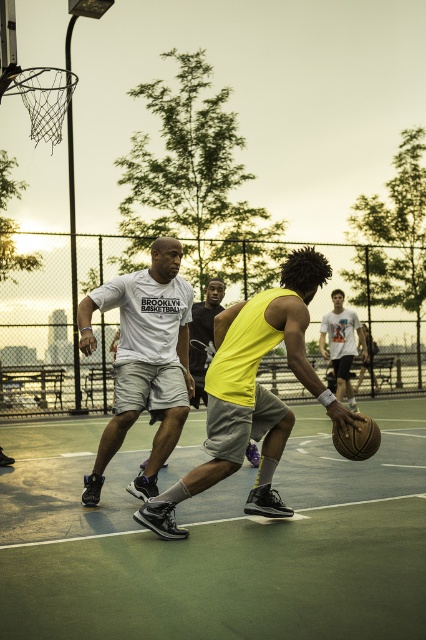
Is green rubber basketball court at center taller than white t-shirt at center?

Incorrect, green rubber basketball court at center's height is not larger of white t-shirt at center's.

Does green rubber basketball court at center appear under white t-shirt at center?

Correct, green rubber basketball court at center is located below white t-shirt at center.

Does point (389, 586) lie in front of point (348, 404)?

Yes, point (389, 586) is closer to viewer.

Identify the location of green rubber basketball court at center. (218, 541).

Does shiny yellow basketball at center have a greater height compared to white matte t-shirt at center?

No, shiny yellow basketball at center is not taller than white matte t-shirt at center.

Is shiny yellow basketball at center to the right of white matte t-shirt at center from the viewer's perspective?

Correct, you'll find shiny yellow basketball at center to the right of white matte t-shirt at center.

Which is in front, point (265, 349) or point (144, 298)?

Point (265, 349) is in front.

Locate an element on the screen. The height and width of the screenshot is (640, 426). shiny yellow basketball at center is located at coordinates [x=252, y=394].

Is metallic silver basketball hoop at upper left taller than shiny brown basketball at center?

Indeed, metallic silver basketball hoop at upper left has a greater height compared to shiny brown basketball at center.

Is the position of metallic silver basketball hoop at upper left less distant than that of shiny brown basketball at center?

No.

You are a GUI agent. You are given a task and a screenshot of the screen. Output one action in this format:
    pyautogui.click(x=<x>, y=<y>)
    Task: Click on the metallic silver basketball hoop at upper left
    The image size is (426, 640).
    Given the screenshot: What is the action you would take?
    tap(43, 99)

This screenshot has width=426, height=640. In order to click on metallic silver basketball hoop at upper left in this screenshot , I will do `click(43, 99)`.